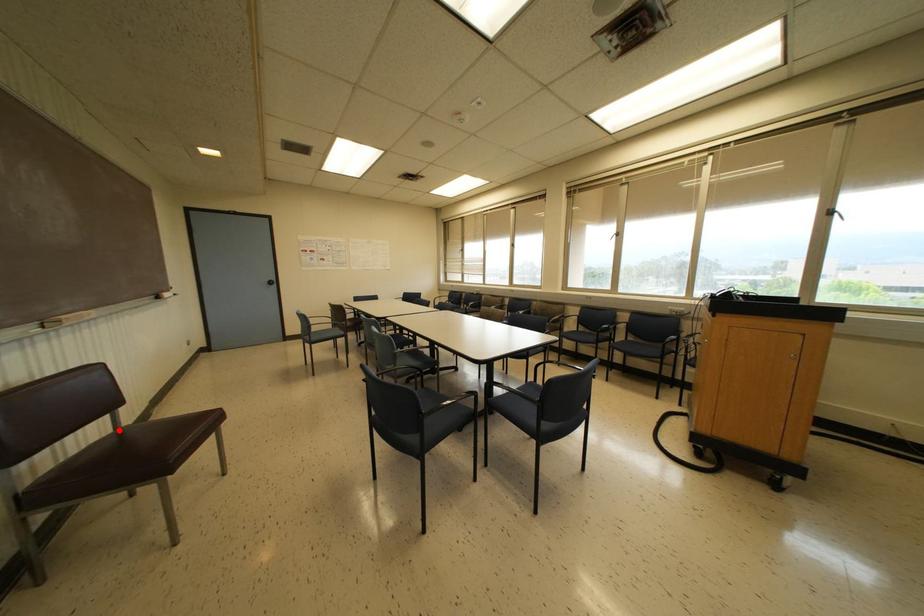
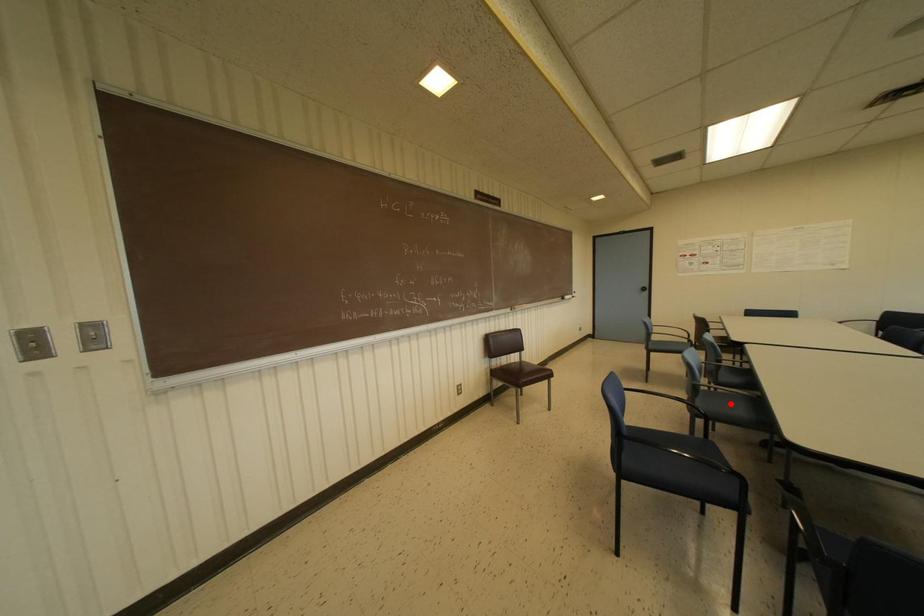
I am providing you with two images of the same scene from different viewpoints. A red point is marked on the first image and another point is marked on the second image. Do the highlighted points in image1 and image2 indicate the same real-world spot?

No